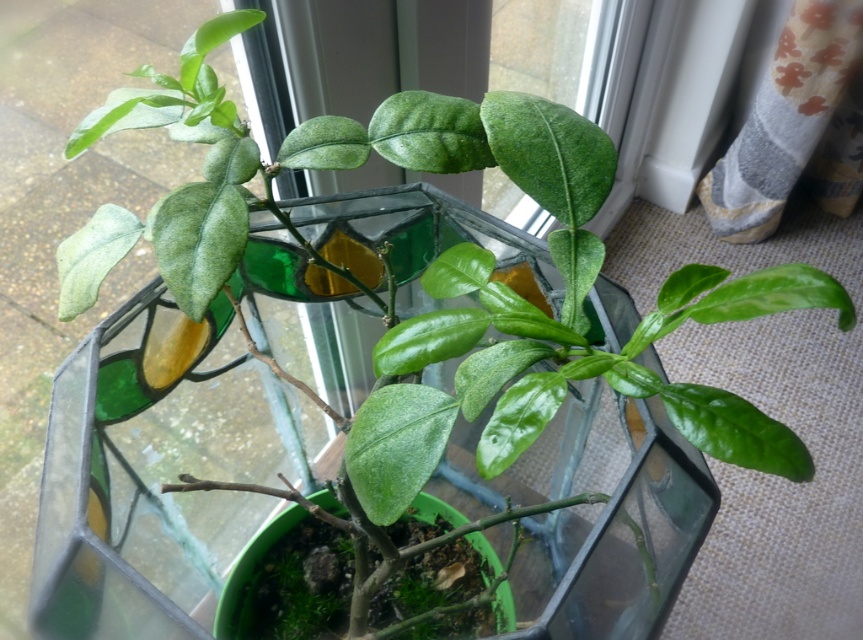
Question: Which object is closer to the camera taking this photo?

Choices:
 (A) green stained glass at center
 (B) green glossy leaves at center
 (C) green matte glass vase at center

Answer: (B)

Question: Can you confirm if green glossy leaves at center is positioned to the right of green matte glass vase at center?

Choices:
 (A) no
 (B) yes

Answer: (B)

Question: Can you confirm if green stained glass at center is positioned to the left of green glossy leaves at center?

Choices:
 (A) no
 (B) yes

Answer: (B)

Question: Which point is farther to the camera?

Choices:
 (A) green stained glass at center
 (B) green glossy leaves at center

Answer: (A)

Question: Which of the following is the farthest from the observer?

Choices:
 (A) (325, 504)
 (B) (580, 333)

Answer: (A)

Question: Can you confirm if green glossy leaves at center is positioned to the right of green matte glass vase at center?

Choices:
 (A) yes
 (B) no

Answer: (A)